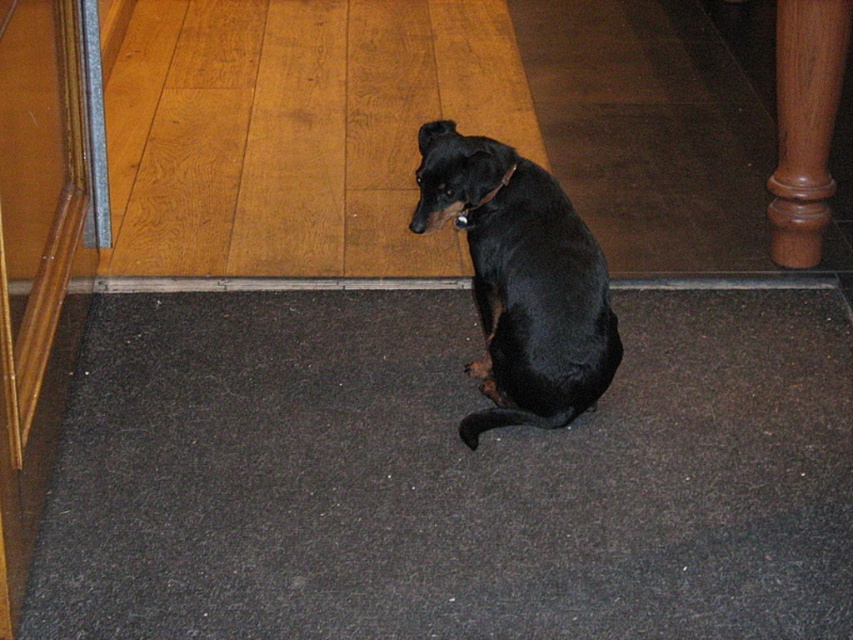
You are standing in the room and see two points marked on the floor. The first point is at coordinate point (556,259) and the second point is at coordinate point (509,166). Which point is closer to you?

Point (556,259) is further to the viewer than point (509,166), so the second point is closer to you.

You are a dog trainer observing the black smooth dog at center and the brown leather neckband at center. Which object is wider?

The black smooth dog at center is wider than the brown leather neckband at center.

You are standing in a room with a wooden floor and a carpet. There is a point at coordinates (521, 280). What is located at that point?

The black smooth dog at center is located at point (521, 280).